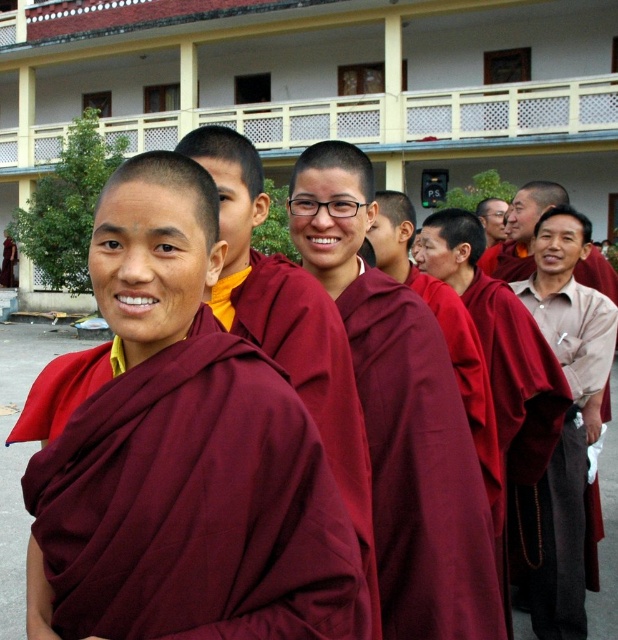
You are standing in front of the maroon cloth at center. You want to reach it without moving your feet. Can you touch it with your outstretched hand?

The maroon cloth at center is 2.89 meters away from you, so you cannot reach it with your outstretched hand since the average human arm length is about 0.7 meters.

You are a visitor at this monastery and need to place a small offering between the maroon cloth at center and the maroon velvet robe at right. Can you fit the offering there if it requires 5 feet of space?

The maroon cloth at center and maroon velvet robe at right are 6.19 feet apart, so yes, the offering can be placed between them as there is enough space.